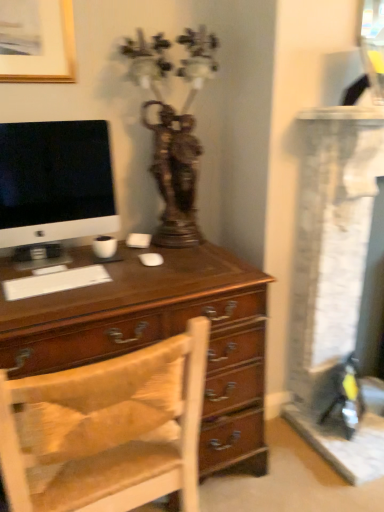
Question: Looking at their shapes, would you say wooden chair at center is wider or thinner than matte black monitor at left?

Choices:
 (A) wide
 (B) thin

Answer: (A)

Question: Would you say wooden chair at center is inside or outside matte black monitor at left?

Choices:
 (A) inside
 (B) outside

Answer: (B)

Question: Which is farther from the wooden chair at center?

Choices:
 (A) matte black monitor at left
 (B) antique bronze statue at upper center
 (C) gold-framed picture at upper left

Answer: (C)

Question: Which object is positioned closest to the matte black monitor at left?

Choices:
 (A) antique bronze statue at upper center
 (B) gold-framed picture at upper left
 (C) wooden chair at center

Answer: (A)